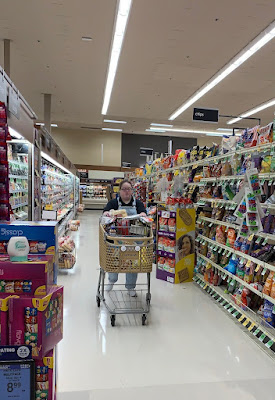
Find the location of a particular element. The image size is (275, 400). strip lights is located at coordinates (212, 80), (251, 110), (108, 92).